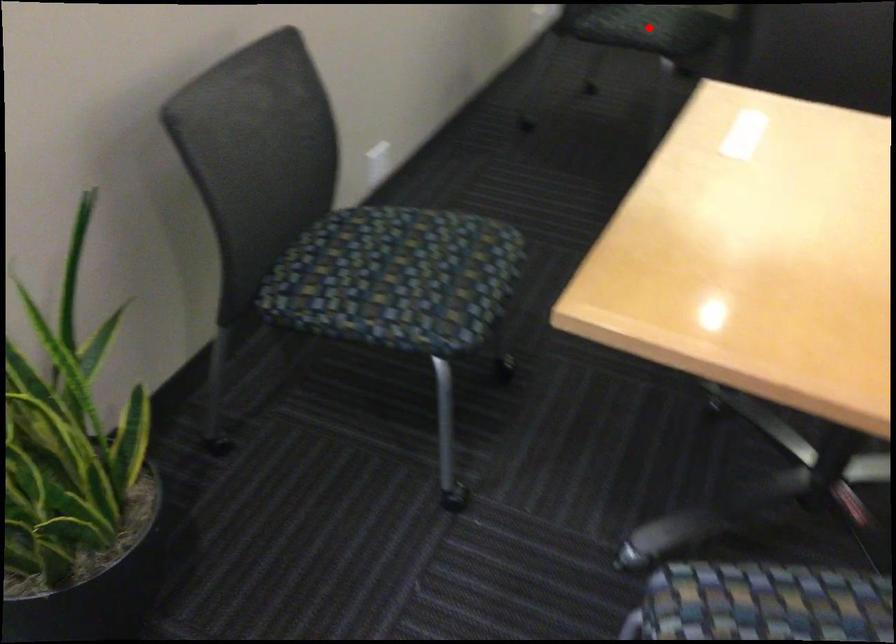
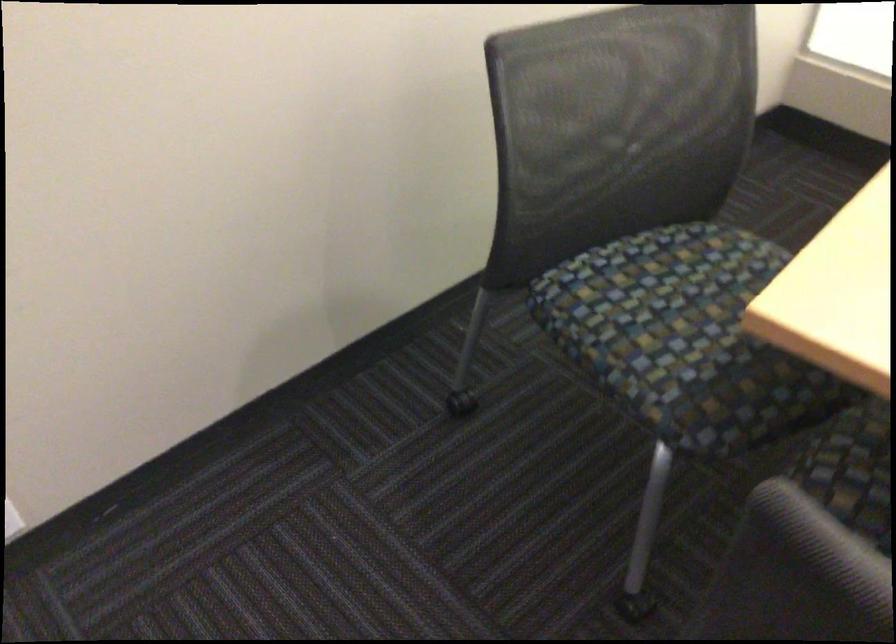
Question: I am providing you with two images of the same scene from different viewpoints. A red point is marked on the first image. Is the red point's position out of view in image 2?

Choices:
 (A) Yes
 (B) No

Answer: (A)